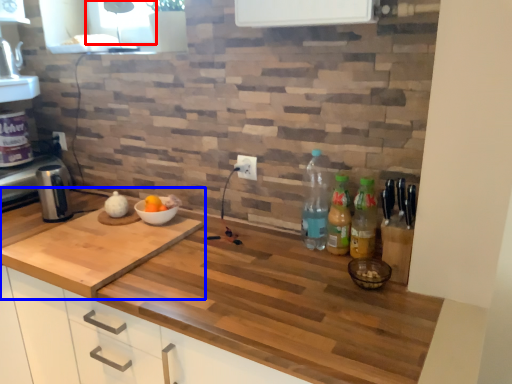
Question: Which of the following is the farthest to the observer, window screen (highlighted by a red box) or countertop (highlighted by a blue box)?

Choices:
 (A) window screen
 (B) countertop

Answer: (A)